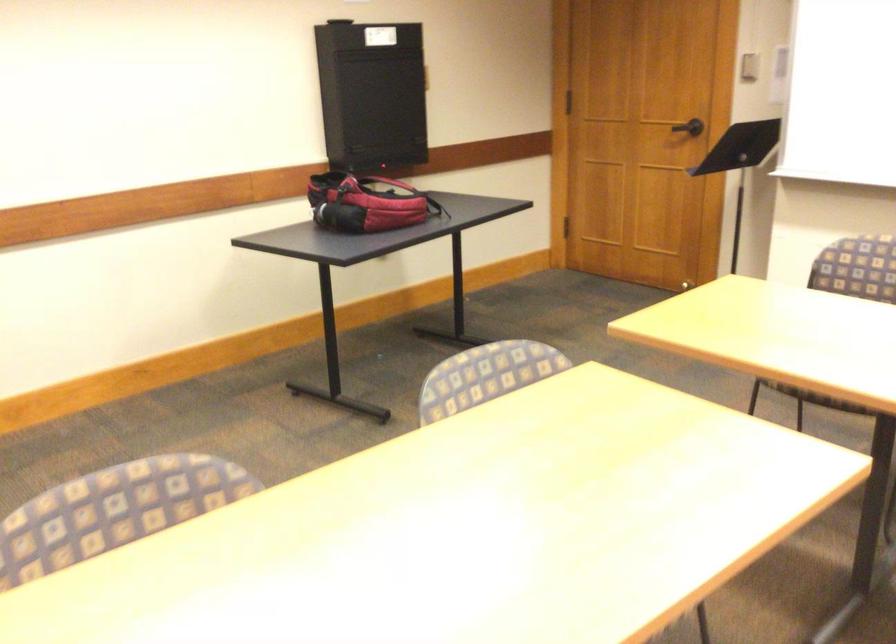
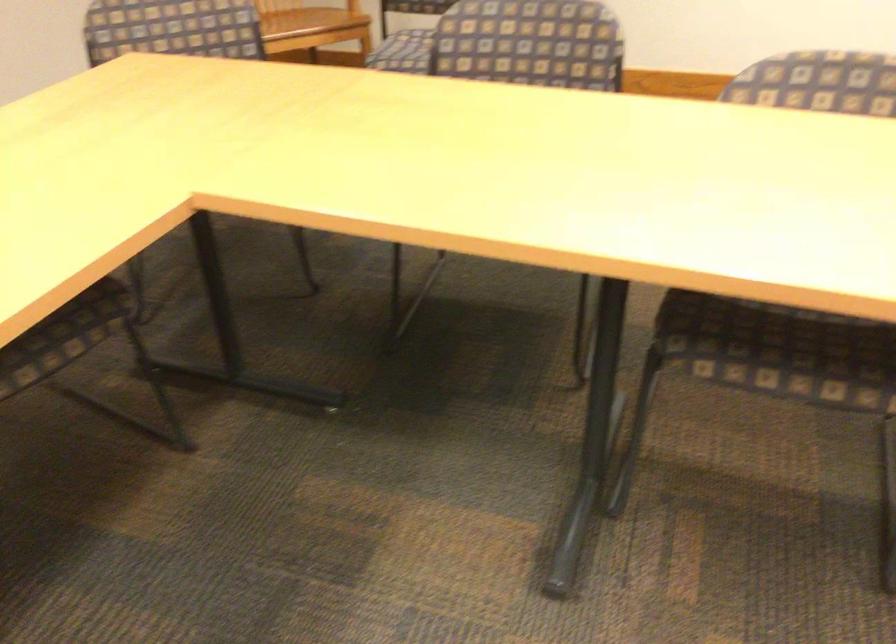
Based on the continuous images, in which direction is the camera rotating?

The camera's rotation is toward left-down.